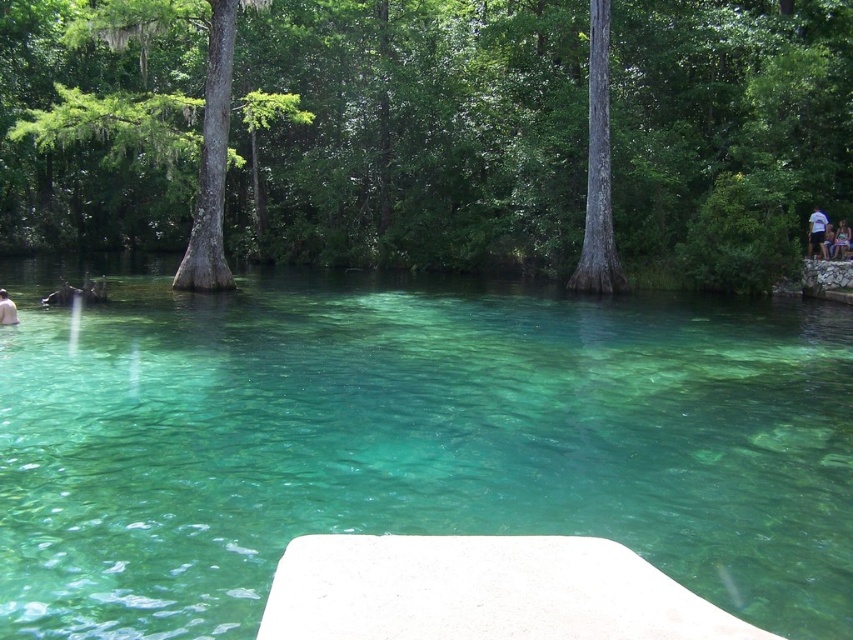
Question: Considering the real-world distances, which object is farthest from the white matte person at lower left?

Choices:
 (A) green leafy tree at center
 (B) green matte tree at center

Answer: (A)

Question: Is green leafy tree at center thinner than light blue denim shorts at right?

Choices:
 (A) no
 (B) yes

Answer: (A)

Question: Which point is closer to the camera?

Choices:
 (A) white cotton shirt at upper right
 (B) clear glassy water at center

Answer: (B)

Question: Among these objects, which one is nearest to the camera?

Choices:
 (A) white matte person at lower left
 (B) clear glassy water at center
 (C) light blue denim shorts at right

Answer: (B)

Question: Does clear glassy water at center appear on the right side of green matte tree at center?

Choices:
 (A) yes
 (B) no

Answer: (B)

Question: Observing the image, what is the correct spatial positioning of green leafy tree at center in reference to white cotton shirt at upper right?

Choices:
 (A) above
 (B) below

Answer: (A)